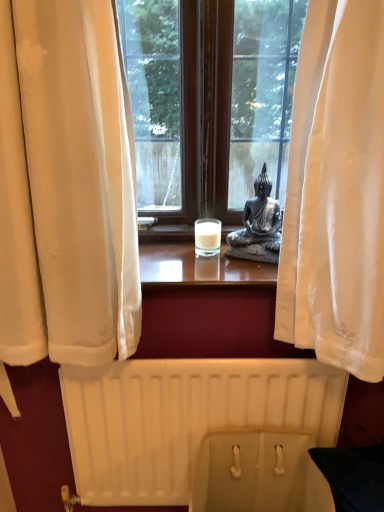
Identify the location of vacant space positioned to the left of white frosted glass candle at center. (168, 253).